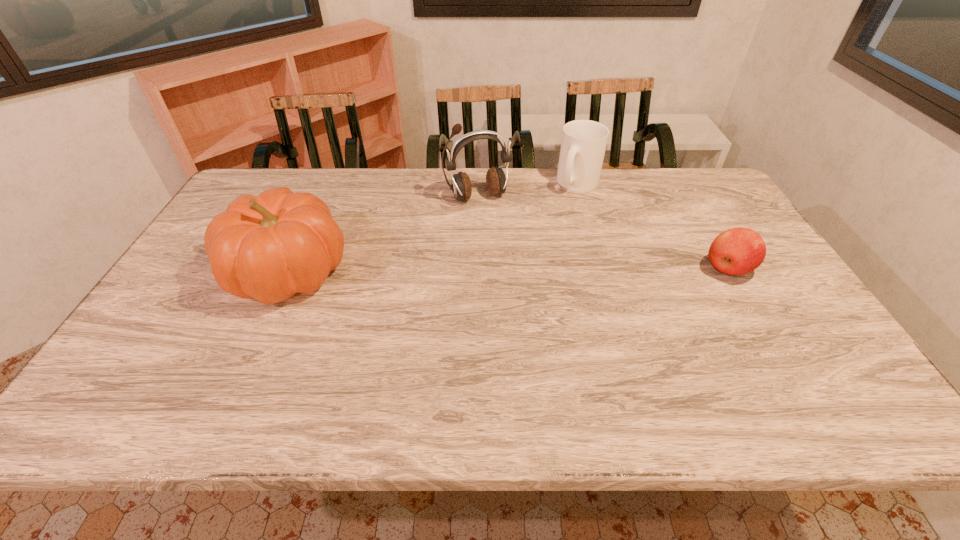
Locate an element on the screen. vacant space that is in between the third object from left to right and the pumpkin is located at coordinates (433, 227).

Identify the location of free space between the earphone and the apple. (603, 233).

Where is `the second closest object to the apple`? The width and height of the screenshot is (960, 540). the second closest object to the apple is located at coordinates (496, 181).

Where is `object that is the third closest to the pumpkin`? object that is the third closest to the pumpkin is located at coordinates (737, 251).

Where is `free spot that satisfies the following two spatial constraints: 1. on the back side of the earphone; 2. on the right side of the third tallest object`? Image resolution: width=960 pixels, height=540 pixels. free spot that satisfies the following two spatial constraints: 1. on the back side of the earphone; 2. on the right side of the third tallest object is located at coordinates (478, 183).

Image resolution: width=960 pixels, height=540 pixels. I want to click on free location that satisfies the following two spatial constraints: 1. on the back side of the second object from left to right; 2. on the right side of the pumpkin, so pos(323,197).

Identify the location of vacant region that satisfies the following two spatial constraints: 1. on the back side of the leftmost object; 2. on the left side of the third tallest object. This screenshot has height=540, width=960. (328, 183).

The image size is (960, 540). What are the coordinates of `free space that satisfies the following two spatial constraints: 1. on the front side of the shortest object; 2. on the left side of the second object from right to left` in the screenshot? It's located at (604, 269).

Identify the location of blank space that satisfies the following two spatial constraints: 1. on the front side of the apple; 2. on the right side of the third object from left to right. (604, 269).